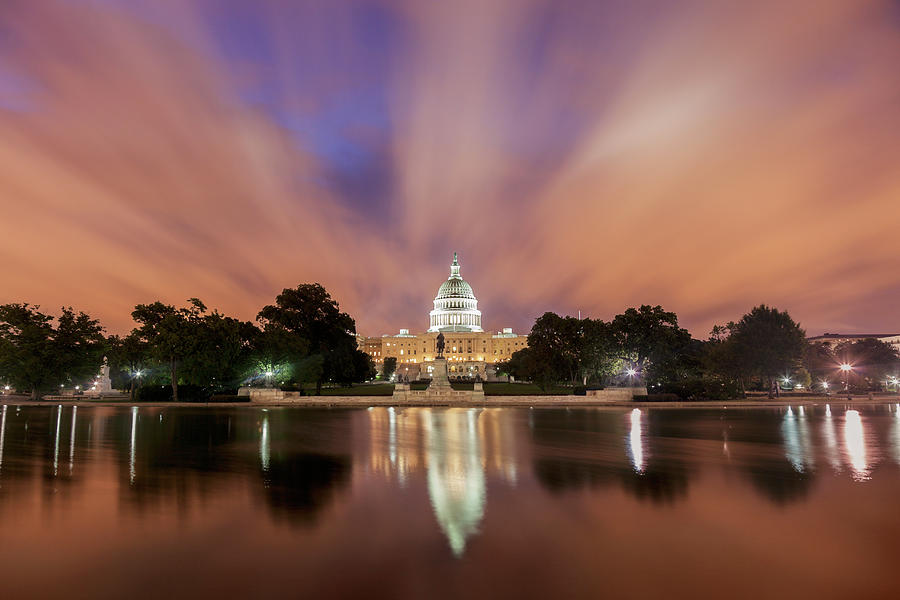
I want to click on light, so click(4, 386).